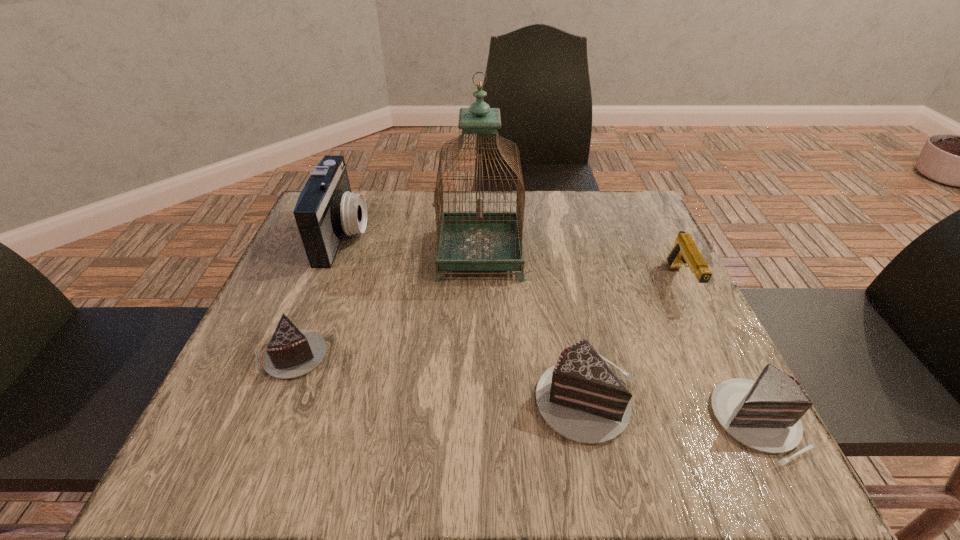
Identify the location of object that is the fifth closest to the shortest chocolate cake. (685, 252).

Where is `chocolate cake that can be found as the second closest to the second chocolate cake from left to right`? chocolate cake that can be found as the second closest to the second chocolate cake from left to right is located at coordinates (291, 352).

The height and width of the screenshot is (540, 960). I want to click on chocolate cake that stands as the second closest to the second chocolate cake from left to right, so click(x=291, y=352).

Where is `free space that satisfies the following two spatial constraints: 1. on the lens of the camcorder; 2. on the left side of the second shortest object`? free space that satisfies the following two spatial constraints: 1. on the lens of the camcorder; 2. on the left side of the second shortest object is located at coordinates (272, 422).

The height and width of the screenshot is (540, 960). Identify the location of vacant area in the image that satisfies the following two spatial constraints: 1. on the lens of the fifth shortest object; 2. on the back side of the second shortest object. (272, 422).

Find the location of a particular element. vacant area that satisfies the following two spatial constraints: 1. at the door of the second chocolate cake from left to right; 2. on the right side of the birdcage is located at coordinates (479, 398).

Locate an element on the screen. The height and width of the screenshot is (540, 960). vacant area in the image that satisfies the following two spatial constraints: 1. at the door of the tallest object; 2. on the left side of the rightmost chocolate cake is located at coordinates (479, 422).

I want to click on free space that satisfies the following two spatial constraints: 1. at the door of the tallest object; 2. on the right side of the second chocolate cake from right to left, so click(479, 398).

In order to click on vacant point that satisfies the following two spatial constraints: 1. at the door of the second shortest chocolate cake; 2. on the right side of the tallest object in this screenshot , I will do `click(479, 422)`.

This screenshot has height=540, width=960. I want to click on vacant region that satisfies the following two spatial constraints: 1. at the barrel of the fifth tallest object; 2. on the right side of the pistol, so click(x=749, y=422).